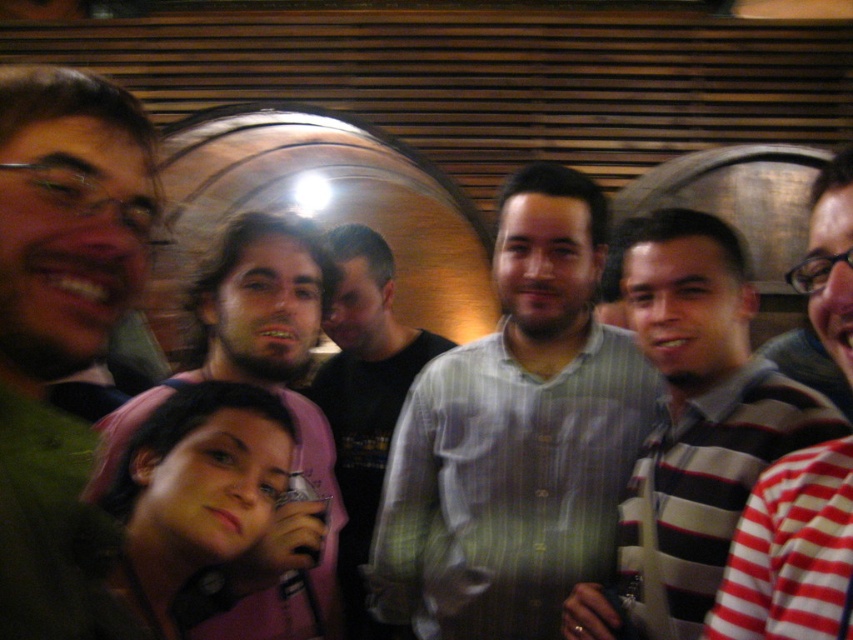
Consider the image. You are a photographer trying to capture a clear shot of both the light green striped shirt at center and the matte pink shirt at center. Since you want both shirts to be in focus, which one should you adjust your camera focus to prioritize first?

You should prioritize focusing on the light green striped shirt at center first because it is closer to the viewer than the matte pink shirt at center. By focusing on the closer object, the background object will also be in focus due to the depth of field.

You are standing in the center of the room and want to move towards the matte pink shirt at center located at point (279, 397). The room has a wooden slatted wall behind the group. Can you walk straight ahead without obstacles in your path?

Yes, you can walk straight ahead towards the matte pink shirt at center located at point 0.628, 0.328 because there are no obstacles mentioned in the scene description between your current position at the center and the target point.